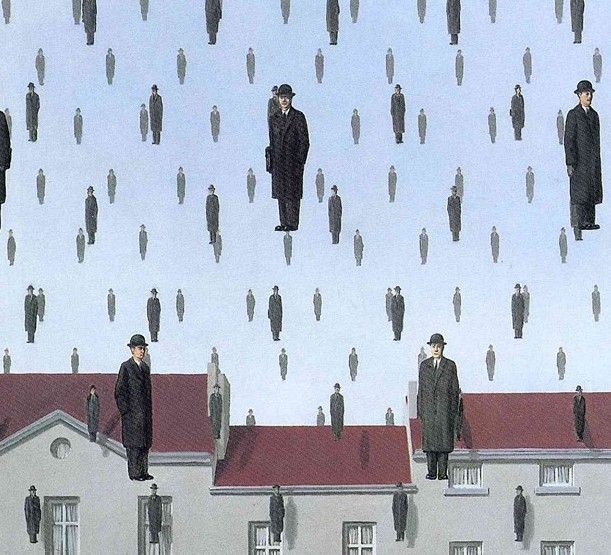
Where is `circular window`? Image resolution: width=611 pixels, height=555 pixels. circular window is located at coordinates (62, 443).